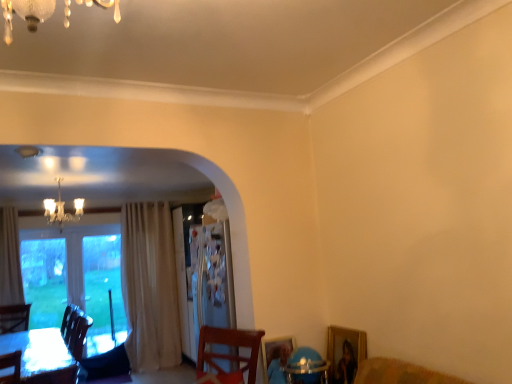
The width and height of the screenshot is (512, 384). What do you see at coordinates (41, 356) in the screenshot?
I see `white glossy table at lower left` at bounding box center [41, 356].

Where is `gold-framed picture at lower right`? This screenshot has height=384, width=512. gold-framed picture at lower right is located at coordinates (345, 352).

You are a GUI agent. You are given a task and a screenshot of the screen. Output one action in this format:
    pyautogui.click(x=<x>, y=<y>)
    Task: Click on the transparent glass window at left
    
    Given the screenshot: What is the action you would take?
    pyautogui.click(x=82, y=269)

Locate an element on the screen. Image resolution: width=512 pixels, height=384 pixels. white glossy table at lower left is located at coordinates (41, 356).

The image size is (512, 384). What are the coordinates of `lamp that is behind the gold-framed picture at lower right` in the screenshot? It's located at (61, 209).

Considering the relative sizes of crystal chandelier at upper left and gold-framed picture at lower right in the image provided, is crystal chandelier at upper left bigger than gold-framed picture at lower right?

Yes, crystal chandelier at upper left is bigger than gold-framed picture at lower right.

Could you tell me if crystal chandelier at upper left is facing gold-framed picture at lower right?

No, crystal chandelier at upper left is not oriented towards gold-framed picture at lower right.

Is gold-framed picture at lower right a part of crystal chandelier at upper left?

No, crystal chandelier at upper left does not contain gold-framed picture at lower right.

Would you say white glossy table at lower left is a long distance from crystal chandelier at upper left?

That's right, there is a large distance between white glossy table at lower left and crystal chandelier at upper left.

Based on the photo, which of these two, white glossy table at lower left or crystal chandelier at upper left, stands shorter?

With less height is crystal chandelier at upper left.

Considering the relative positions of white glossy table at lower left and crystal chandelier at upper left in the image provided, is white glossy table at lower left to the left or to the right of crystal chandelier at upper left?

Clearly, white glossy table at lower left is on the right of crystal chandelier at upper left in the image.

From a real-world perspective, which is physically above, white glossy table at lower left or crystal chandelier at upper left?

crystal chandelier at upper left is physically above.

Is gold-framed picture at lower right beside blue plastic round table at lower right?

They are not placed beside each other.

Consider the image. Considering the sizes of objects gold-framed picture at lower right and blue plastic round table at lower right in the image provided, who is bigger, gold-framed picture at lower right or blue plastic round table at lower right?

Bigger between the two is blue plastic round table at lower right.

From a real-world perspective, is gold-framed picture at lower right physically above blue plastic round table at lower right?

Incorrect, from a real-world perspective, gold-framed picture at lower right is lower than blue plastic round table at lower right.

At what (x,y) coordinates should I click in order to perform the action: click on window above the blue plastic round table at lower right (from a real-world perspective). Please return your answer as a coordinate pair (x, y). Looking at the image, I should click on (82, 269).

Does point (303, 353) come farther from viewer compared to point (75, 239)?

No, (303, 353) is in front of (75, 239).

How many degrees apart are the facing directions of blue plastic round table at lower right and transparent glass window at left?

There is a 65.6-degree angle between the facing directions of blue plastic round table at lower right and transparent glass window at left.

From the image's perspective, is white glossy table at lower left above or below blue plastic round table at lower right?

white glossy table at lower left is situated lower than blue plastic round table at lower right in the image.

Is white glossy table at lower left taller or shorter than blue plastic round table at lower right?

In the image, white glossy table at lower left appears to be taller than blue plastic round table at lower right.

Is white glossy table at lower left far away from blue plastic round table at lower right?

Absolutely, white glossy table at lower left is distant from blue plastic round table at lower right.

Between point (11, 339) and point (309, 378), which one is positioned behind?

The point (11, 339) is farther from the camera.

Is blue plastic round table at lower right with crystal chandelier at upper left?

No, blue plastic round table at lower right is not touching crystal chandelier at upper left.

Between blue plastic round table at lower right and crystal chandelier at upper left, which one has larger size?

crystal chandelier at upper left.

From the picture: From the image's perspective, is blue plastic round table at lower right above crystal chandelier at upper left?

No.

Based on the photo, is crystal chandelier at upper left completely or partially outside of white glossy table at lower left?

Yes, crystal chandelier at upper left is located beyond the bounds of white glossy table at lower left.

Is crystal chandelier at upper left directly adjacent to white glossy table at lower left?

No, crystal chandelier at upper left is not next to white glossy table at lower left.

From a real-world perspective, who is located higher, crystal chandelier at upper left or white glossy table at lower left?

From a 3D spatial view, crystal chandelier at upper left is above.

Does crystal chandelier at upper left have a greater height compared to white glossy table at lower left?

No.

Identify the location of lamp above the gold-framed picture at lower right (from the image's perspective). The width and height of the screenshot is (512, 384). (61, 209).

This screenshot has width=512, height=384. What are the coordinates of `lamp above the white glossy table at lower left (from a real-world perspective)` in the screenshot? It's located at (61, 209).

Looking at the image, which one is located further to crystal chandelier at upper left, white glossy table at lower left or blue plastic round table at lower right?

blue plastic round table at lower right lies further to crystal chandelier at upper left than the other object.

From the image, which object appears to be farther from gold-framed picture at lower right, crystal chandelier at upper left or blue plastic round table at lower right?

The object further to gold-framed picture at lower right is crystal chandelier at upper left.

Which object lies further to the anchor point white glossy table at lower left, crystal chandelier at upper left or gold-framed picture at lower right?

gold-framed picture at lower right lies further to white glossy table at lower left than the other object.

When comparing their distances from blue plastic round table at lower right, does gold-framed picture at lower right or white glossy table at lower left seem closer?

The object closer to blue plastic round table at lower right is gold-framed picture at lower right.

Based on their spatial positions, is blue plastic round table at lower right or transparent glass window at left further from white glossy table at lower left?

blue plastic round table at lower right.

From the image, which object appears to be farther from gold-framed picture at lower right, blue plastic round table at lower right or crystal chandelier at upper left?

crystal chandelier at upper left is further to gold-framed picture at lower right.

From the image, which object appears to be nearer to white glossy table at lower left, transparent glass window at left or blue plastic round table at lower right?

Based on the image, transparent glass window at left appears to be nearer to white glossy table at lower left.

From the image, which object appears to be farther from gold-framed picture at lower right, crystal chandelier at upper left or transparent glass window at left?

Among the two, transparent glass window at left is located further to gold-framed picture at lower right.

The height and width of the screenshot is (384, 512). I want to click on lamp between white glossy table at lower left and transparent glass window at left in the front-back direction, so click(x=61, y=209).

The image size is (512, 384). I want to click on round table between white glossy table at lower left and gold-framed picture at lower right, so click(x=306, y=367).

Where is `round table between transparent glass window at left and gold-framed picture at lower right`? The image size is (512, 384). round table between transparent glass window at left and gold-framed picture at lower right is located at coordinates (306, 367).

Where is `table positioned between blue plastic round table at lower right and transparent glass window at left from near to far`? The image size is (512, 384). table positioned between blue plastic round table at lower right and transparent glass window at left from near to far is located at coordinates (41, 356).